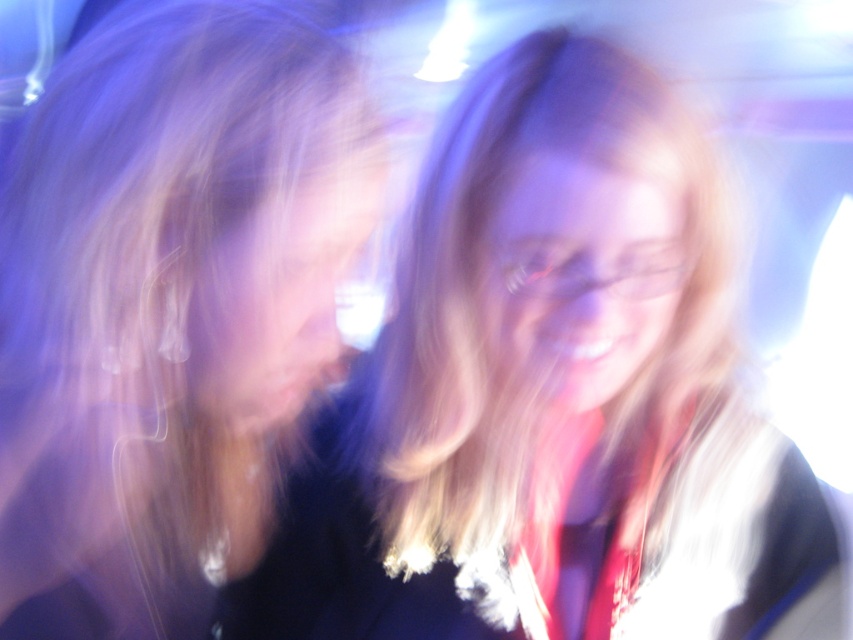
Does blonde hair at center come behind blonde hair at left?

No, it is in front of blonde hair at left.

Is point (425, 566) positioned before point (306, 278)?

That is False.

You are a GUI agent. You are given a task and a screenshot of the screen. Output one action in this format:
    pyautogui.click(x=<x>, y=<y>)
    Task: Click on the blonde hair at center
    The width and height of the screenshot is (853, 640).
    Given the screenshot: What is the action you would take?
    pyautogui.click(x=553, y=397)